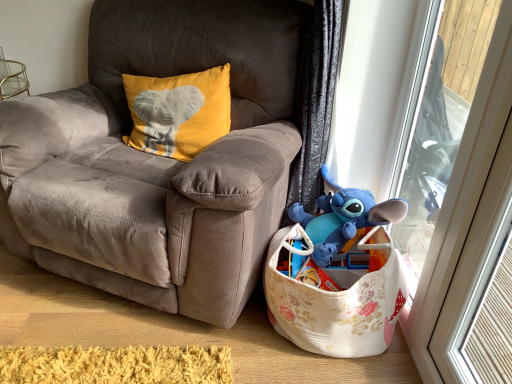
Question: Is yellow soft fabric pillow with elephant design at upper left taller than blue plush toy at lower right?

Choices:
 (A) no
 (B) yes

Answer: (B)

Question: Is yellow soft fabric pillow with elephant design at upper left placed right next to blue plush toy at lower right?

Choices:
 (A) no
 (B) yes

Answer: (A)

Question: Is yellow soft fabric pillow with elephant design at upper left closer to camera compared to blue plush toy at lower right?

Choices:
 (A) no
 (B) yes

Answer: (A)

Question: Is the depth of yellow soft fabric pillow with elephant design at upper left greater than that of blue plush toy at lower right?

Choices:
 (A) yes
 (B) no

Answer: (A)

Question: Can you confirm if yellow soft fabric pillow with elephant design at upper left is wider than blue plush toy at lower right?

Choices:
 (A) no
 (B) yes

Answer: (A)

Question: Which is correct: floral fabric basket at lower right is inside blue plush toy at lower right, or outside of it?

Choices:
 (A) inside
 (B) outside

Answer: (B)

Question: In terms of height, does floral fabric basket at lower right look taller or shorter compared to blue plush toy at lower right?

Choices:
 (A) tall
 (B) short

Answer: (A)

Question: From the image's perspective, is floral fabric basket at lower right positioned above or below blue plush toy at lower right?

Choices:
 (A) below
 (B) above

Answer: (A)

Question: Does point (375, 322) appear closer or farther from the camera than point (335, 246)?

Choices:
 (A) closer
 (B) farther

Answer: (A)

Question: From a real-world perspective, relative to floral fabric basket at lower right, is suede gray chair at center vertically above or below?

Choices:
 (A) below
 (B) above

Answer: (B)

Question: Considering the positions of suede gray chair at center and floral fabric basket at lower right in the image, is suede gray chair at center wider or thinner than floral fabric basket at lower right?

Choices:
 (A) thin
 (B) wide

Answer: (B)

Question: Is suede gray chair at center taller or shorter than floral fabric basket at lower right?

Choices:
 (A) short
 (B) tall

Answer: (B)

Question: Is point (125, 236) closer or farther from the camera than point (377, 344)?

Choices:
 (A) closer
 (B) farther

Answer: (A)

Question: Would you say suede gray chair at center is inside or outside yellow soft fabric pillow with elephant design at upper left?

Choices:
 (A) inside
 (B) outside

Answer: (B)

Question: Relative to yellow soft fabric pillow with elephant design at upper left, is suede gray chair at center in front or behind?

Choices:
 (A) behind
 (B) front

Answer: (B)